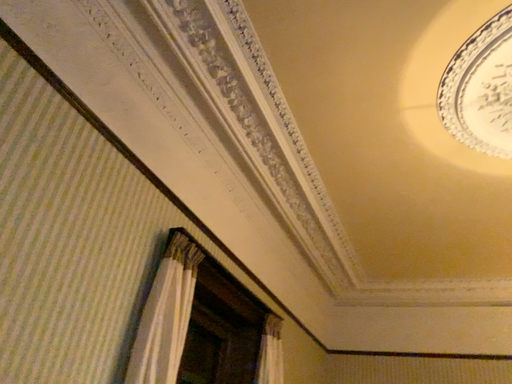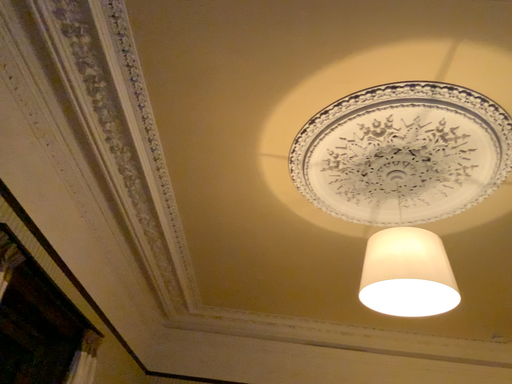
Question: How did the camera likely rotate when shooting the video?

Choices:
 (A) rotated right
 (B) rotated left

Answer: (A)